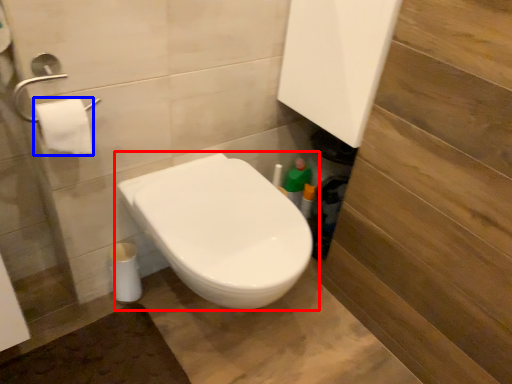
Question: Which point is closer to the camera, toilet (highlighted by a red box) or toilet paper (highlighted by a blue box)?

Choices:
 (A) toilet
 (B) toilet paper

Answer: (A)